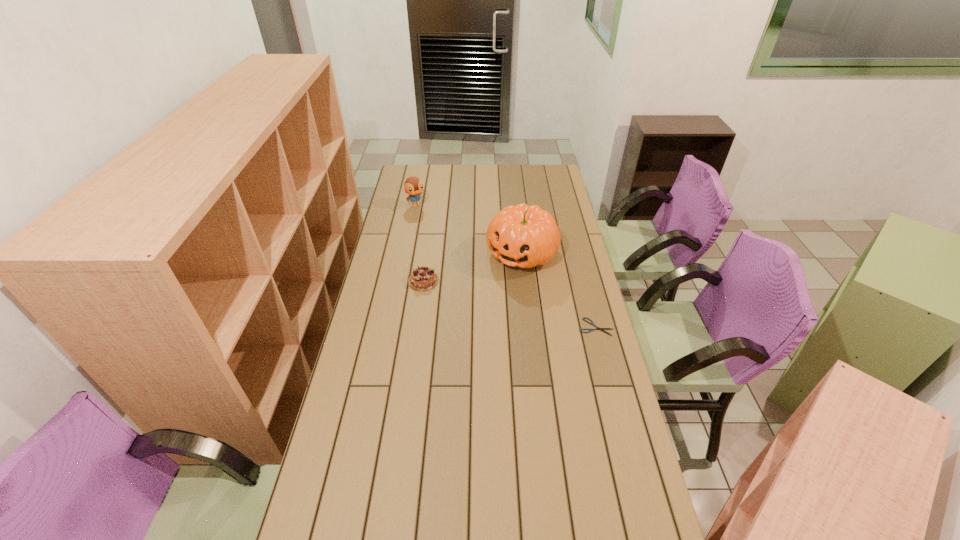
Find the location of a particular element. vacant space on the desktop that is between the second shortest object and the shears and is positioned on the carved face of the tallest object is located at coordinates (484, 297).

At what (x,y) coordinates should I click in order to perform the action: click on vacant spot on the desktop that is between the chocolate cake and the rightmost object and is positioned on the front-facing side of the duck. Please return your answer as a coordinate pair (x, y). Looking at the image, I should click on (489, 298).